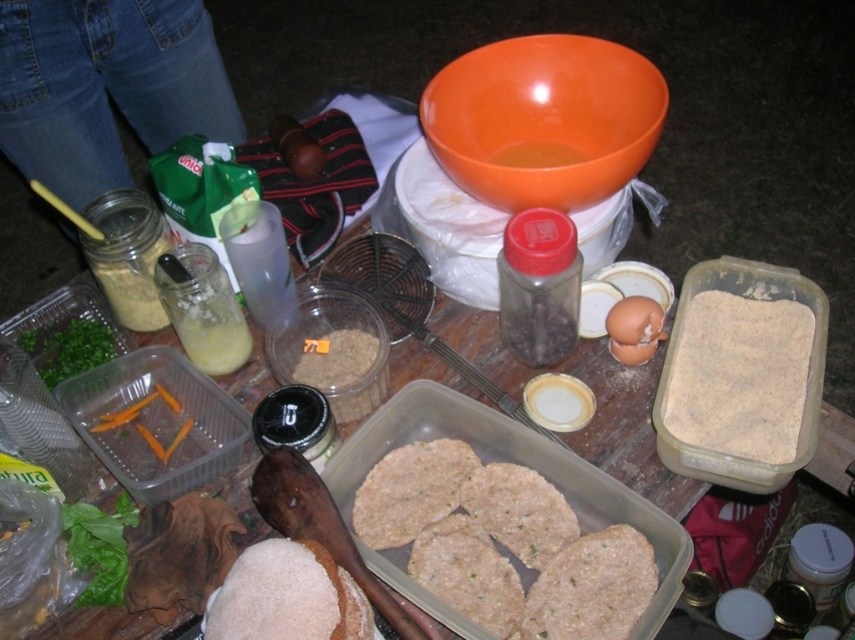
Who is positioned more to the left, brown textured patties at center or brown powder at center?

From the viewer's perspective, brown textured patties at center appears more on the left side.

Can you confirm if brown textured patties at center is positioned to the right of brown powder at center?

In fact, brown textured patties at center is to the left of brown powder at center.

Image resolution: width=855 pixels, height=640 pixels. Describe the element at coordinates (503, 545) in the screenshot. I see `brown textured patties at center` at that location.

Locate an element on the screen. brown textured patties at center is located at coordinates (503, 545).